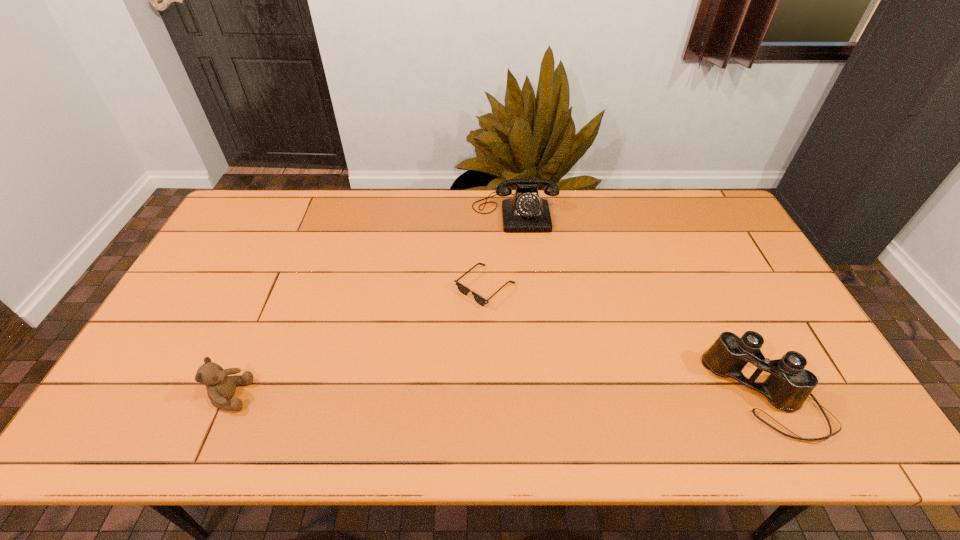
The height and width of the screenshot is (540, 960). In order to click on vacant space on the desktop that is between the teddy bear and the rightmost object and is positioned on the lenses of the shortest object in this screenshot , I will do `click(451, 396)`.

Locate an element on the screen. free spot on the desktop that is between the leftmost object and the binoculars and is positioned on the front face of the farthest object is located at coordinates coord(533,396).